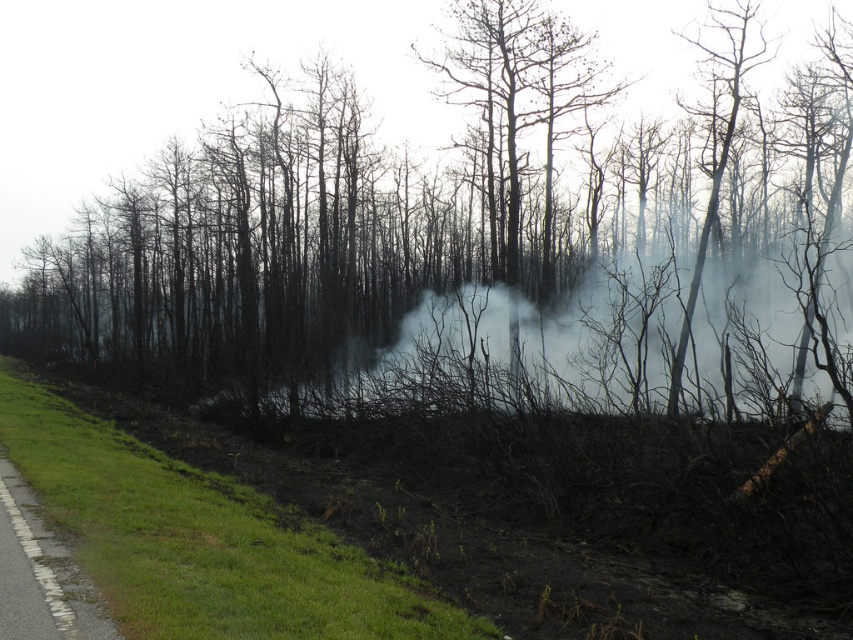
Who is more forward, (x=700, y=291) or (x=480, y=314)?

Positioned in front is point (x=700, y=291).

This screenshot has height=640, width=853. What do you see at coordinates (453, 212) in the screenshot? I see `charcoal bark tree at center` at bounding box center [453, 212].

Locate an element on the screen. The height and width of the screenshot is (640, 853). charcoal bark tree at center is located at coordinates (453, 212).